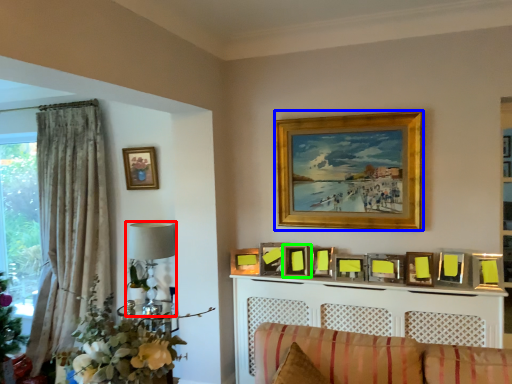
Question: Which object is the farthest from lamp (highlighted by a red box)? Choose among these: picture frame (highlighted by a blue box) or picture frame (highlighted by a green box).

Choices:
 (A) picture frame
 (B) picture frame

Answer: (A)